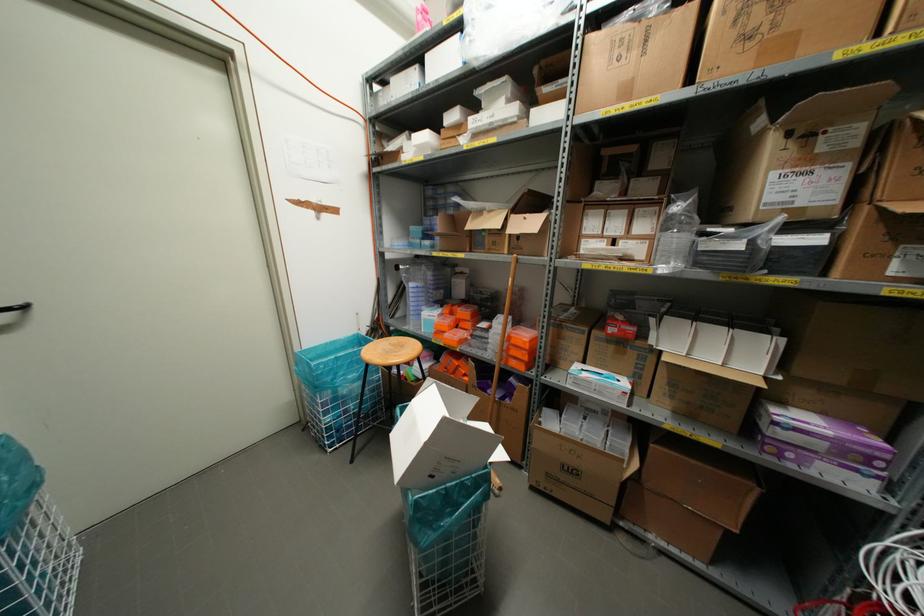
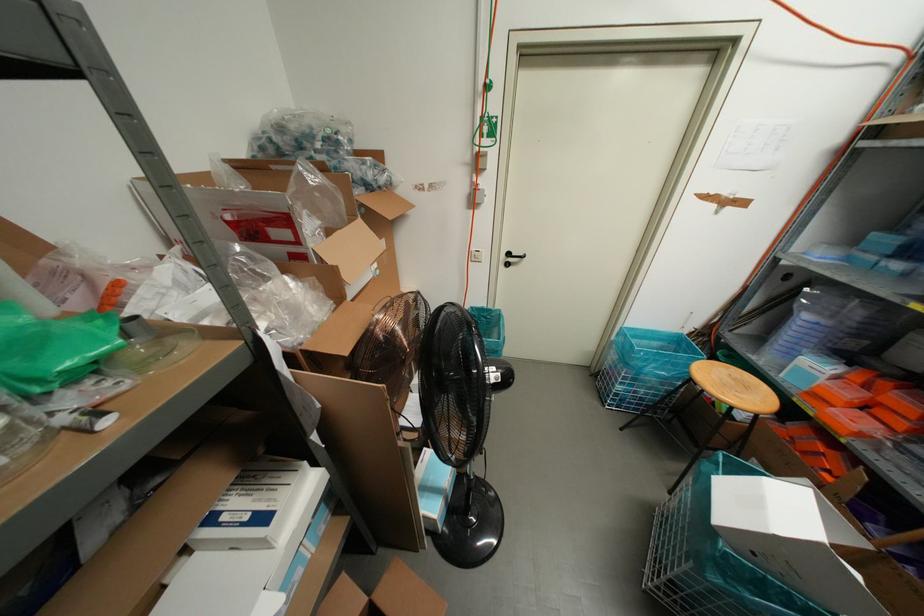
Find the pixel in the second image that matches the point at 400,345 in the first image.

(745, 387)